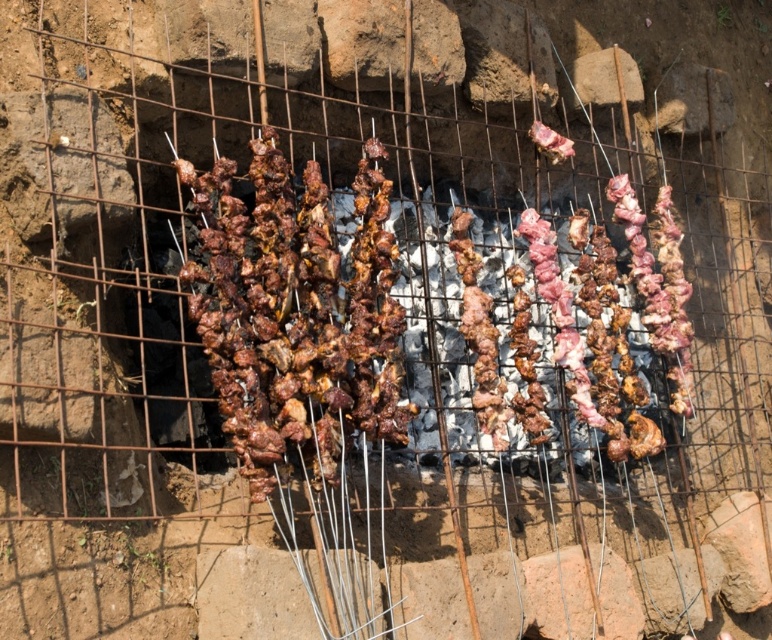
Is brown charred skewers at center closer to camera compared to pink raw meat at center?

Yes, it is in front of pink raw meat at center.

Is brown charred skewers at center shorter than pink raw meat at center?

No.

The width and height of the screenshot is (772, 640). I want to click on brown charred skewers at center, so click(x=300, y=308).

Who is positioned more to the left, brown charred skewers at center or brown charred meat at center?

brown charred meat at center

Describe the element at coordinates (300, 308) in the screenshot. I see `brown charred skewers at center` at that location.

The width and height of the screenshot is (772, 640). I want to click on brown charred skewers at center, so click(x=300, y=308).

Between point (202, 292) and point (564, 156), which one is positioned in front?

Positioned in front is point (202, 292).

The image size is (772, 640). Identify the location of brown charred meat at center. (296, 312).